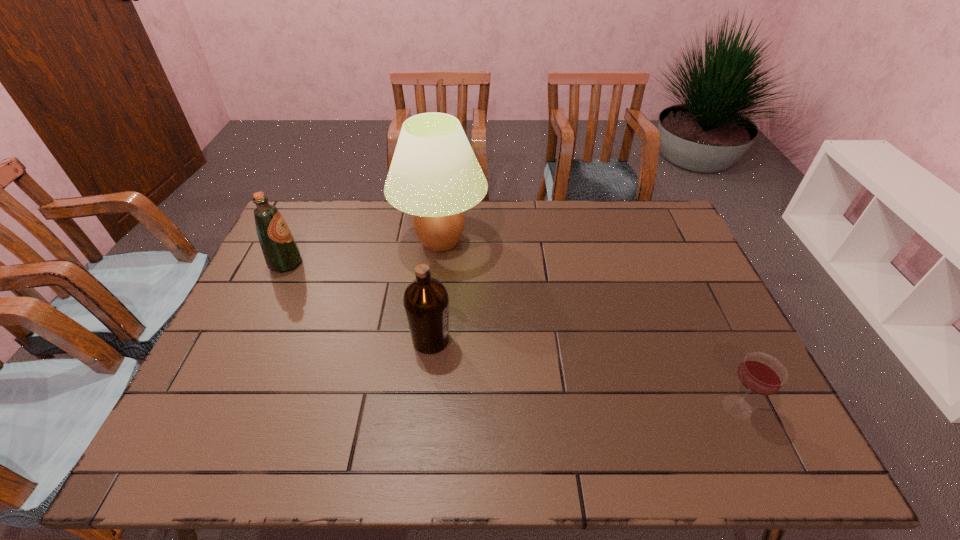
Where is `empty space that is in between the nearest object and the lampshade`? empty space that is in between the nearest object and the lampshade is located at coordinates (588, 324).

At what (x,y) coordinates should I click in order to perform the action: click on free space between the lampshade and the leftmost object. Please return your answer as a coordinate pair (x, y). The image size is (960, 540). Looking at the image, I should click on click(x=363, y=252).

At what (x,y) coordinates should I click in order to perform the action: click on free spot between the rightmost object and the right olive oil. Please return your answer as a coordinate pair (x, y). The image size is (960, 540). Looking at the image, I should click on (584, 373).

You are a GUI agent. You are given a task and a screenshot of the screen. Output one action in this format:
    pyautogui.click(x=<x>, y=<y>)
    Task: Click on the free space between the right olive oil and the leftmost object
    
    Given the screenshot: What is the action you would take?
    pyautogui.click(x=358, y=301)

You are a GUI agent. You are given a task and a screenshot of the screen. Output one action in this format:
    pyautogui.click(x=<x>, y=<y>)
    Task: Click on the free space between the wineglass and the left olive oil
    This screenshot has width=960, height=540.
    Given the screenshot: What is the action you would take?
    pyautogui.click(x=512, y=335)

You are a GUI agent. You are given a task and a screenshot of the screen. Output one action in this format:
    pyautogui.click(x=<x>, y=<y>)
    Task: Click on the free space that is in between the left olive oil and the tallest object
    
    Given the screenshot: What is the action you would take?
    pyautogui.click(x=363, y=252)

Where is `free point between the nearer olive oil and the left olive oil`? free point between the nearer olive oil and the left olive oil is located at coordinates tap(358, 301).

The image size is (960, 540). Identify the location of object that is the third nearest to the lampshade. pos(760,373).

The image size is (960, 540). Find the location of `object that stands as the second closest to the tallest object`. object that stands as the second closest to the tallest object is located at coordinates (281, 253).

This screenshot has height=540, width=960. In order to click on vacant space that satisfies the following two spatial constraints: 1. on the shade of the lampshade; 2. on the right side of the wineglass in this screenshot , I will do `click(423, 407)`.